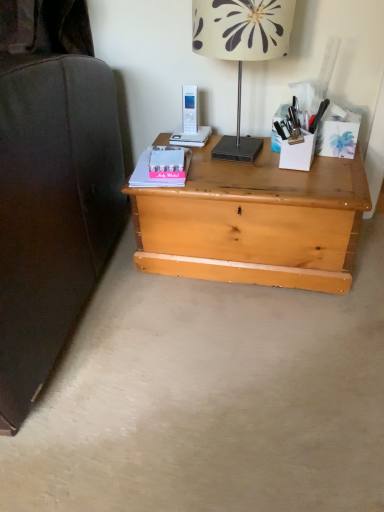
In order to click on spots to the right of pink matte paperback book at center, the first paperback book when ordered from back to front in this screenshot , I will do click(x=229, y=170).